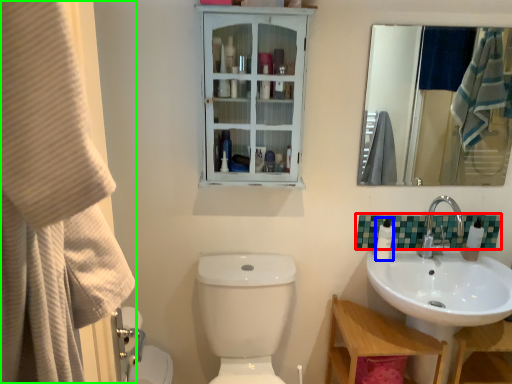
Question: Which object is positioned closest to tile (highlighted by a red box)? Select from toiletry (highlighted by a blue box) and shower curtain (highlighted by a green box).

Choices:
 (A) toiletry
 (B) shower curtain

Answer: (A)